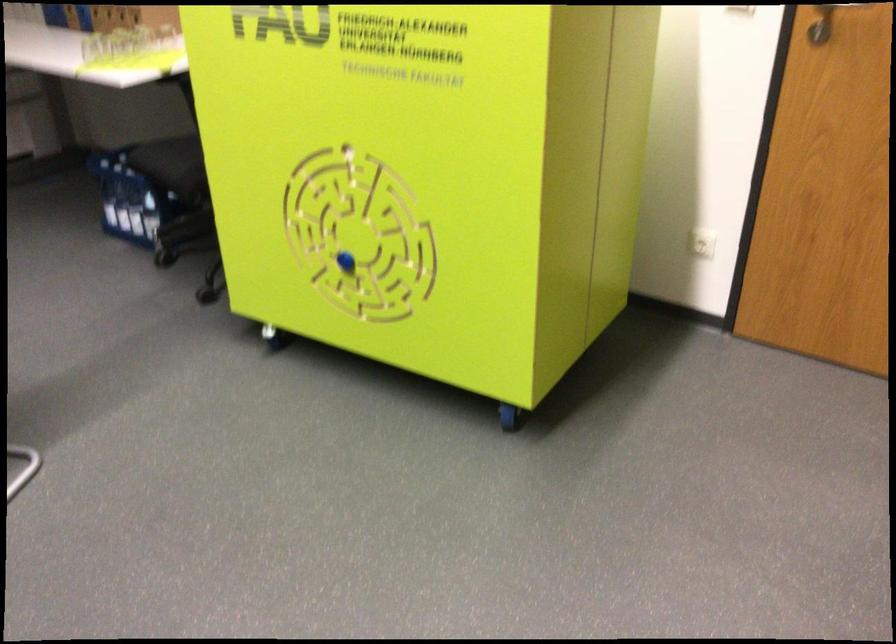
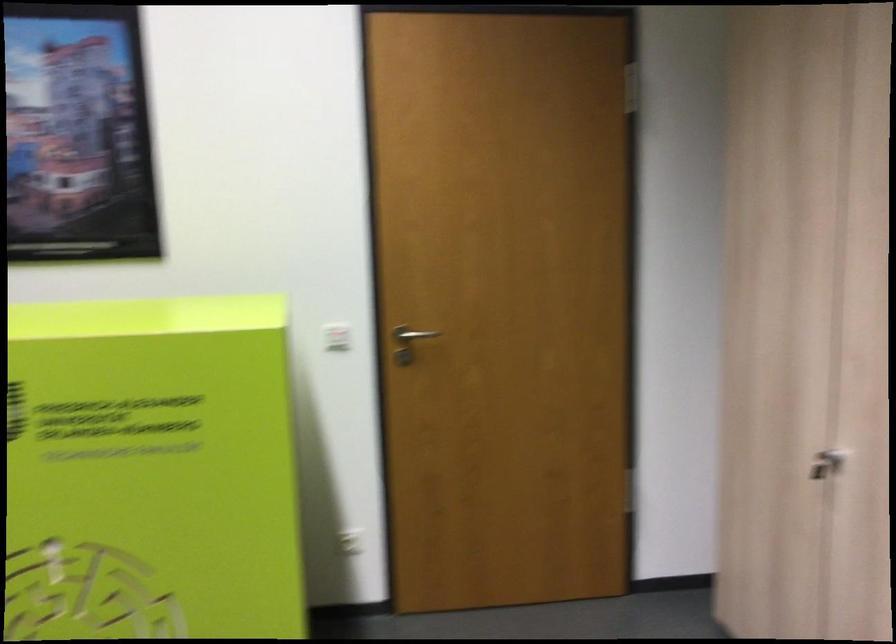
Question: The camera is either moving clockwise (left) or counter-clockwise (right) around the object. The first image is from the beginning of the video and the second image is from the end. Is the camera moving left or right when shooting the video?

Choices:
 (A) Left
 (B) Right

Answer: (A)